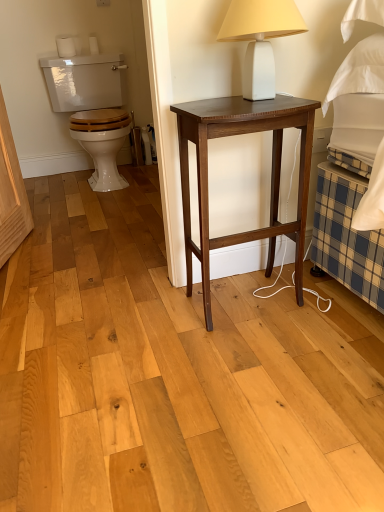
Locate an element on the screen. free space in front of dark wood nightstand at center is located at coordinates (266, 359).